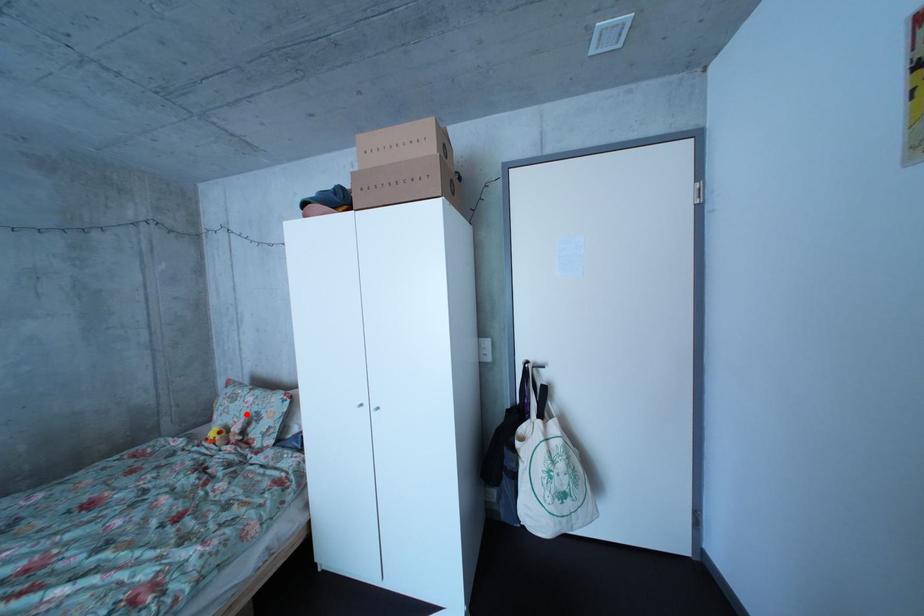
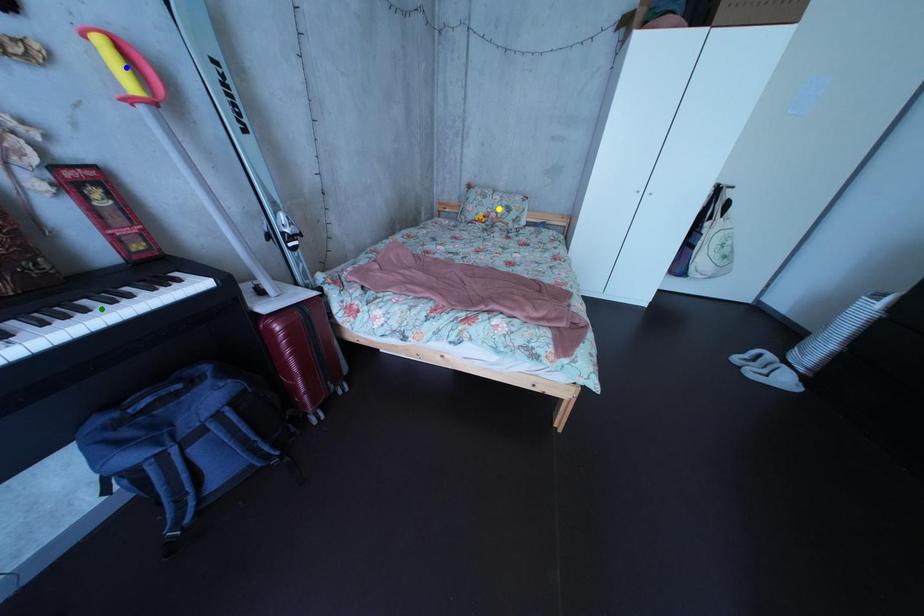
Question: I am providing you with two images of the same scene from different viewpoints. A red point is marked on the first image. You are given multiple points on the second image. Which point in image 2 is actually the same real-world point as the red point in image 1?

Choices:
 (A) green point
 (B) blue point
 (C) yellow point

Answer: (C)